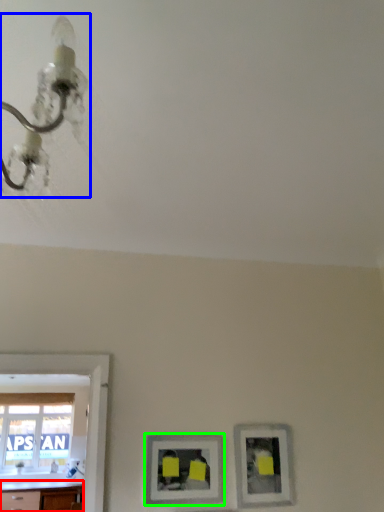
Question: Estimate the real-world distances between objects in this image. Which object is farther from counter top (highlighted by a red box), light fixture (highlighted by a blue box) or picture frame (highlighted by a green box)?

Choices:
 (A) light fixture
 (B) picture frame

Answer: (A)